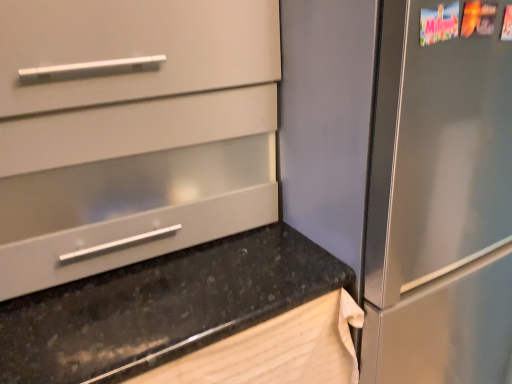
Locate an element on the screen. matte white drawer at center is located at coordinates (132, 132).

What do you see at coordinates (132, 132) in the screenshot? I see `matte white drawer at center` at bounding box center [132, 132].

Measure the distance between black granite countertop at lower left and camera.

black granite countertop at lower left is 25.51 inches away from camera.

Measure the distance between point (306, 280) and camera.

87.00 centimeters.

The height and width of the screenshot is (384, 512). What do you see at coordinates (162, 307) in the screenshot? I see `black granite countertop at lower left` at bounding box center [162, 307].

Where is `black granite countertop at lower left`? black granite countertop at lower left is located at coordinates (162, 307).

Locate an element on the screen. matte white drawer at center is located at coordinates (132, 132).

Is matte white drawer at center at the right side of black granite countertop at lower left?

No, matte white drawer at center is not to the right of black granite countertop at lower left.

Based on the photo, considering the positions of objects matte white drawer at center and black granite countertop at lower left in the image provided, who is in front, matte white drawer at center or black granite countertop at lower left?

black granite countertop at lower left is in front.

Is point (203, 184) closer to viewer compared to point (305, 260)?

That is False.

From the image's perspective, which is below, matte white drawer at center or black granite countertop at lower left?

black granite countertop at lower left.

From a real-world perspective, relative to black granite countertop at lower left, is matte white drawer at center vertically above or below?

From a real-world perspective, matte white drawer at center is physically above black granite countertop at lower left.

Which of these two, matte white drawer at center or black granite countertop at lower left, is wider?

With larger width is black granite countertop at lower left.

Considering the sizes of objects matte white drawer at center and black granite countertop at lower left in the image provided, who is taller, matte white drawer at center or black granite countertop at lower left?

With more height is black granite countertop at lower left.

From the picture: Considering the relative sizes of matte white drawer at center and black granite countertop at lower left in the image provided, is matte white drawer at center smaller than black granite countertop at lower left?

Yes, matte white drawer at center is smaller than black granite countertop at lower left.

Would you say matte white drawer at center is inside or outside black granite countertop at lower left?

matte white drawer at center is outside black granite countertop at lower left.

Is there a large distance between matte white drawer at center and black granite countertop at lower left?

They are positioned close to each other.

In the scene shown: Is matte white drawer at center facing away from black granite countertop at lower left?

matte white drawer at center is not turned away from black granite countertop at lower left.

How different are the orientations of matte white drawer at center and black granite countertop at lower left in degrees?

There is a 1.08-degree angle between the facing directions of matte white drawer at center and black granite countertop at lower left.

The width and height of the screenshot is (512, 384). In order to click on countertop lying on the right of matte white drawer at center in this screenshot , I will do `click(162, 307)`.

Is black granite countertop at lower left at the right side of matte white drawer at center?

Correct, you'll find black granite countertop at lower left to the right of matte white drawer at center.

Which object is further away from the camera taking this photo, black granite countertop at lower left or matte white drawer at center?

matte white drawer at center.

Is point (251, 293) closer to camera compared to point (84, 172)?

No, (251, 293) is further to viewer.

From the image's perspective, relative to matte white drawer at center, is black granite countertop at lower left above or below?

Based on their image positions, black granite countertop at lower left is located beneath matte white drawer at center.

Based on the photo, from a real-world perspective, which object rests below the other?

In real-world perspective, black granite countertop at lower left is lower.

Looking at their sizes, would you say black granite countertop at lower left is wider or thinner than matte white drawer at center?

Considering their sizes, black granite countertop at lower left looks broader than matte white drawer at center.

Who is shorter, black granite countertop at lower left or matte white drawer at center?

matte white drawer at center is shorter.

Considering the sizes of objects black granite countertop at lower left and matte white drawer at center in the image provided, who is bigger, black granite countertop at lower left or matte white drawer at center?

black granite countertop at lower left is bigger.

Consider the image. Is black granite countertop at lower left inside or outside of matte white drawer at center?

black granite countertop at lower left is located beyond the bounds of matte white drawer at center.

Is black granite countertop at lower left in contact with matte white drawer at center?

black granite countertop at lower left is not next to matte white drawer at center, and they're not touching.

Is black granite countertop at lower left oriented away from matte white drawer at center?

No, matte white drawer at center is not at the back of black granite countertop at lower left.

From the picture: How different are the orientations of black granite countertop at lower left and matte white drawer at center in degrees?

1.08 degrees.

Locate an element on the screen. This screenshot has height=384, width=512. cabinetry above the black granite countertop at lower left (from a real-world perspective) is located at coordinates (132, 132).

Find the location of a particular element. This screenshot has height=384, width=512. countertop on the right of matte white drawer at center is located at coordinates [162, 307].

Identify the location of cabinetry to the left of black granite countertop at lower left. (132, 132).